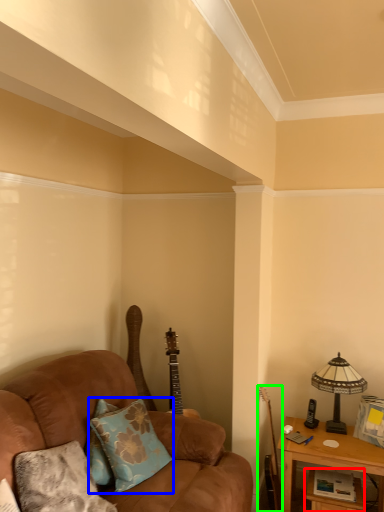
Question: Based on their relative distances, which object is farther from table (highlighted by a red box)? Choose from pillow (highlighted by a blue box) and guitar (highlighted by a green box).

Choices:
 (A) pillow
 (B) guitar

Answer: (A)